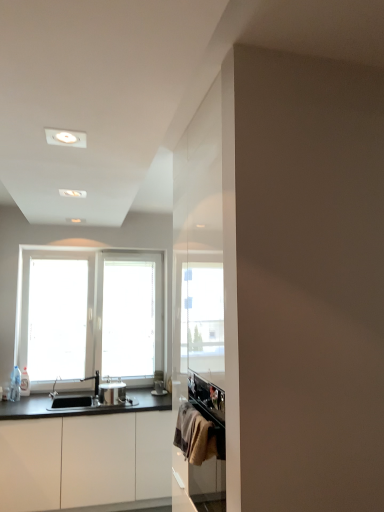
Where is `vacant space that is to the left of satin nickel faucet at sink left`? vacant space that is to the left of satin nickel faucet at sink left is located at coordinates (69, 396).